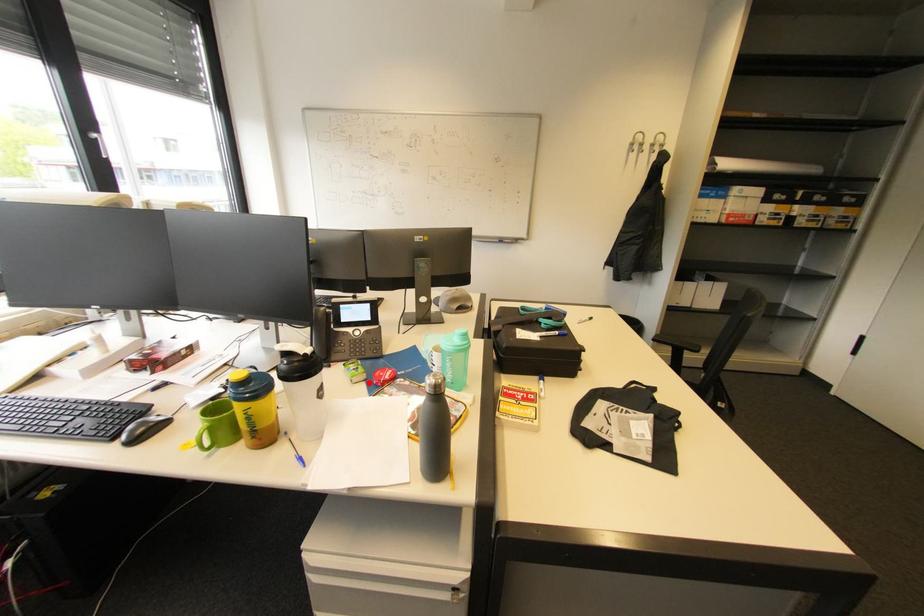
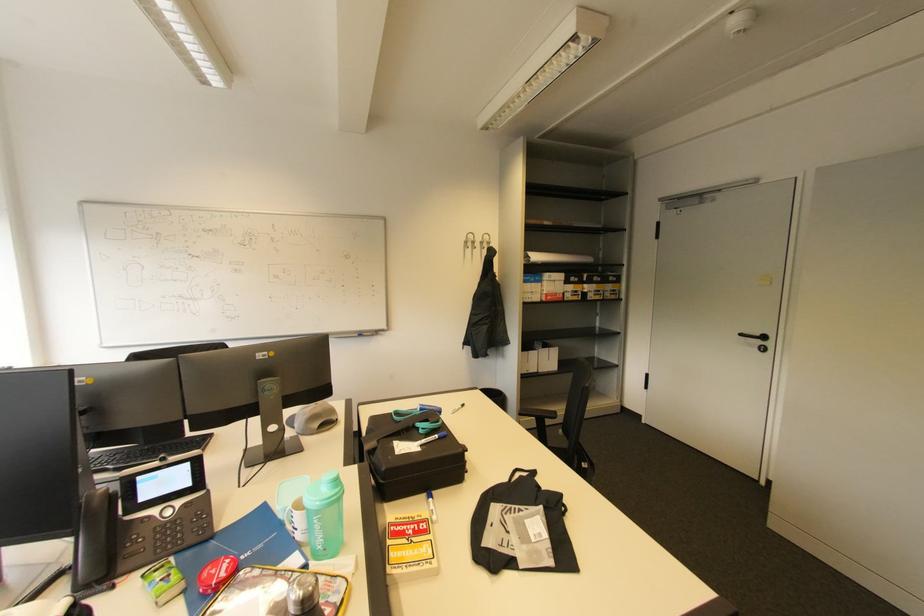
Find the pixel in the second image that matches the highlighted location in the first image.

(187, 597)